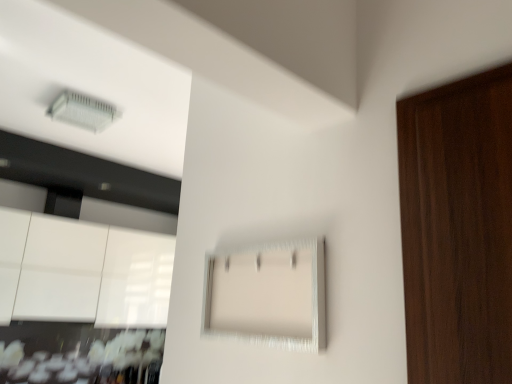
Question: From the image's perspective, relative to clear plastic air conditioning unit at upper left, is white textured cabinet at center, arranged as the second cabinetry when viewed from the left, above or below?

Choices:
 (A) below
 (B) above

Answer: (A)

Question: Is white textured cabinet at center, arranged as the second cabinetry when viewed from the left, wider or thinner than clear plastic air conditioning unit at upper left?

Choices:
 (A) thin
 (B) wide

Answer: (A)

Question: Estimate the real-world distances between objects in this image. Which object is farther from the clear plastic air conditioning unit at upper left?

Choices:
 (A) glossy white cabinetry at lower left, marked as the 2th cabinetry in a front-to-back arrangement
 (B) white textured cabinet at center, which is the first cabinetry in right-to-left order

Answer: (B)

Question: Which object is the farthest from the glossy white cabinetry at lower left, which is the second cabinetry in right-to-left order?

Choices:
 (A) clear plastic air conditioning unit at upper left
 (B) white textured cabinet at center, arranged as the second cabinetry when viewed from the left

Answer: (B)